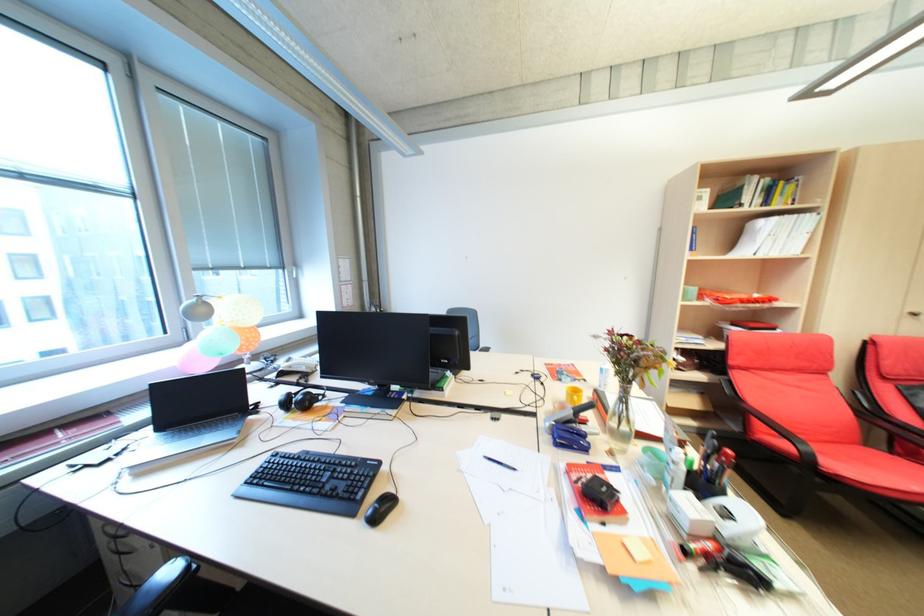
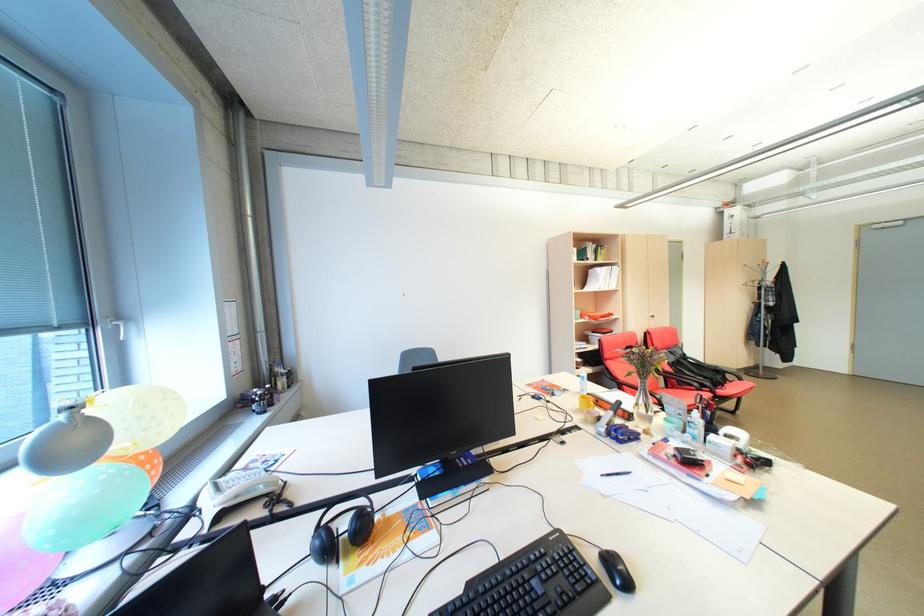
In the second image, find the point that corresponds to the point at 311,370 in the first image.

(271, 490)